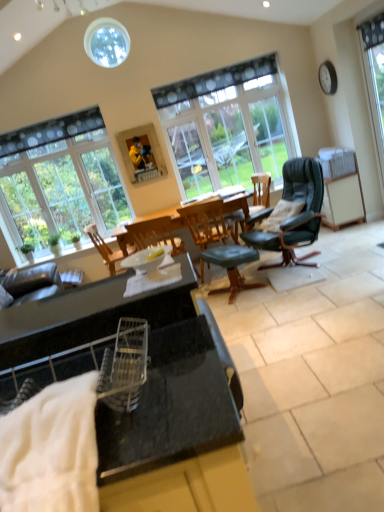
Question: In the image, is clear glass window at upper left, which ranks as the 3th window in right-to-left order, positioned in front of or behind green leather stool at center?

Choices:
 (A) behind
 (B) front

Answer: (A)

Question: From a real-world perspective, is clear glass window at upper left, marked as the first window in a left-to-right arrangement, positioned above or below green leather stool at center?

Choices:
 (A) above
 (B) below

Answer: (A)

Question: Estimate the real-world distances between objects in this image. Which object is closer to the wooden chair at center, the first chair when ordered from left to right?

Choices:
 (A) leather-like black chair at center-right, which is the third chair in left-to-right order
 (B) black granite cabinet at center
 (C) transparent glass window at center, which appears as the second window when viewed from the back
 (D) white textured blanket at lower left
 (E) clear glass window at right, acting as the first window starting from the front

Answer: (A)

Question: Which object is positioned farthest from the leather-like black chair at center-right, acting as the 1th chair starting from the right?

Choices:
 (A) black granite cabinet at center
 (B) wooden picture frame at upper center
 (C) clear glass window at right, the 3th window when ordered from back to front
 (D) white textured blanket at lower left
 (E) clear glass window at upper left, the third window in the front-to-back sequence

Answer: (D)